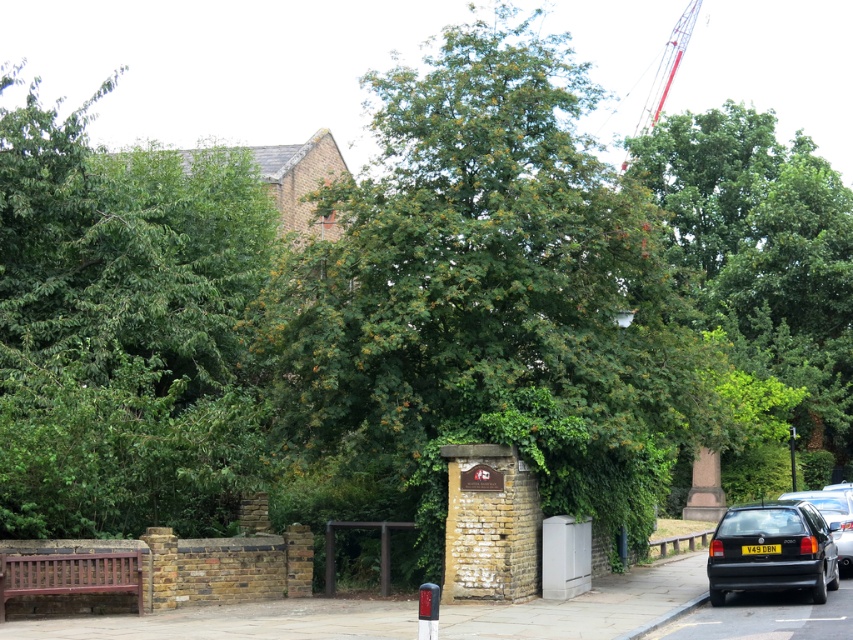
Question: Among these objects, which one is farthest from the camera?

Choices:
 (A) green leafy tree at upper right
 (B) green leafy tree at left
 (C) wooden bench at lower left
 (D) brown wooden bench at lower left

Answer: (A)

Question: Which of the following is the farthest from the observer?

Choices:
 (A) green leafy tree at upper right
 (B) metallic street sign at center

Answer: (B)

Question: Does matte black hatchback at lower right appear on the right side of metallic red crane at upper right?

Choices:
 (A) yes
 (B) no

Answer: (B)

Question: Does brown wooden bench at lower left appear under metallic street sign at center?

Choices:
 (A) yes
 (B) no

Answer: (A)

Question: Considering the real-world distances, which object is closest to the matte black hatchback at lower right?

Choices:
 (A) brown wooden bench at lower left
 (B) metallic street sign at center

Answer: (A)

Question: Does green leafy tree at left appear on the right side of wooden bench at lower left?

Choices:
 (A) yes
 (B) no

Answer: (B)